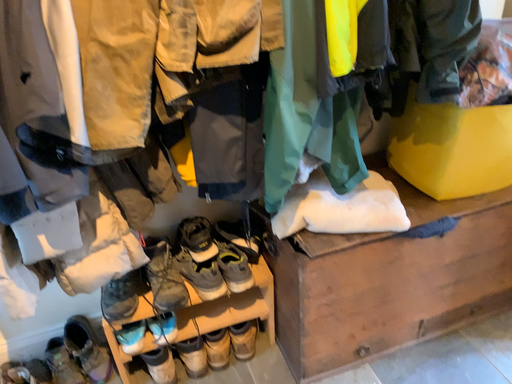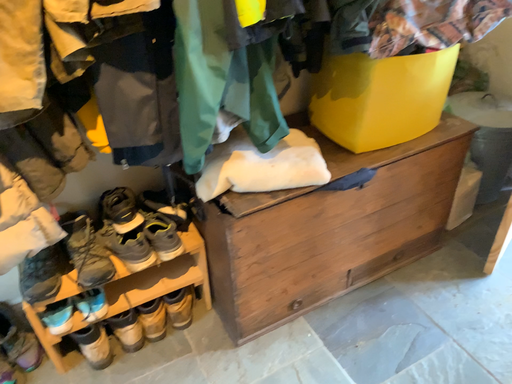
Question: How did the camera likely rotate when shooting the video?

Choices:
 (A) rotated right
 (B) rotated left

Answer: (A)